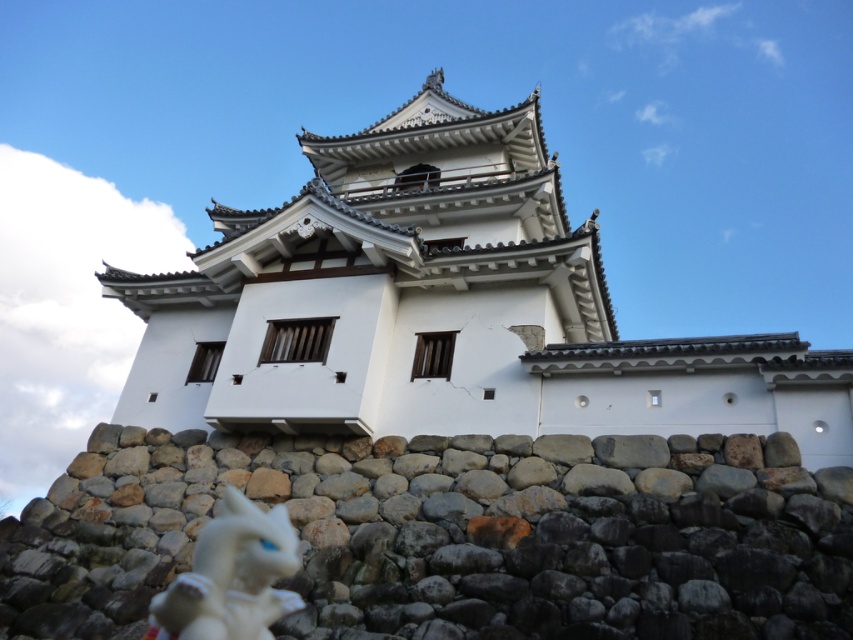
You are a tour guide explaining the historical significance of the traditional Japanese building to a group. You notice a rough stone wall at lower center and a white glossy figurine at lower left nearby. How far apart are these two objects?

The rough stone wall at lower center and white glossy figurine at lower left are 26.23 feet apart from each other.

You are standing in front of a traditional Japanese building and notice two structures. One is the white stone fort at center and the other is the rough stone wall at lower center. Which one is positioned to the right side from your viewpoint?

The white stone fort at center is positioned to the right of the rough stone wall at lower center, so the white stone fort at center is on the right side from your viewpoint.

You are standing in front of a traditional Japanese building with a stone wall. There is a rough stone wall at lower center. Where is the rough stone wall located in relation to the point at coordinates (454, 536)?

The rough stone wall at lower center is represented by the point at coordinates (454, 536).